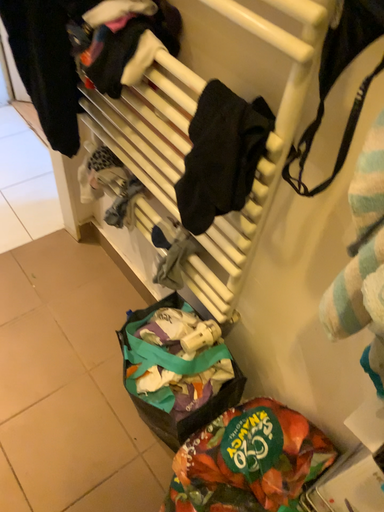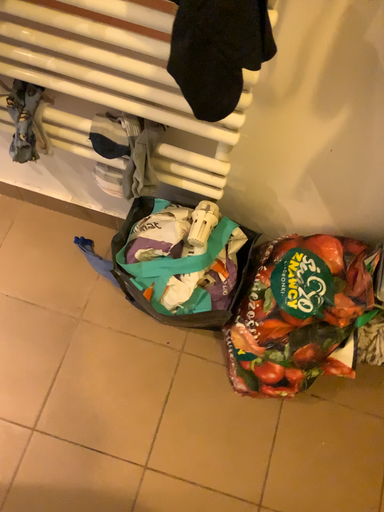
Question: Which way did the camera rotate in the video?

Choices:
 (A) rotated left
 (B) rotated right

Answer: (B)